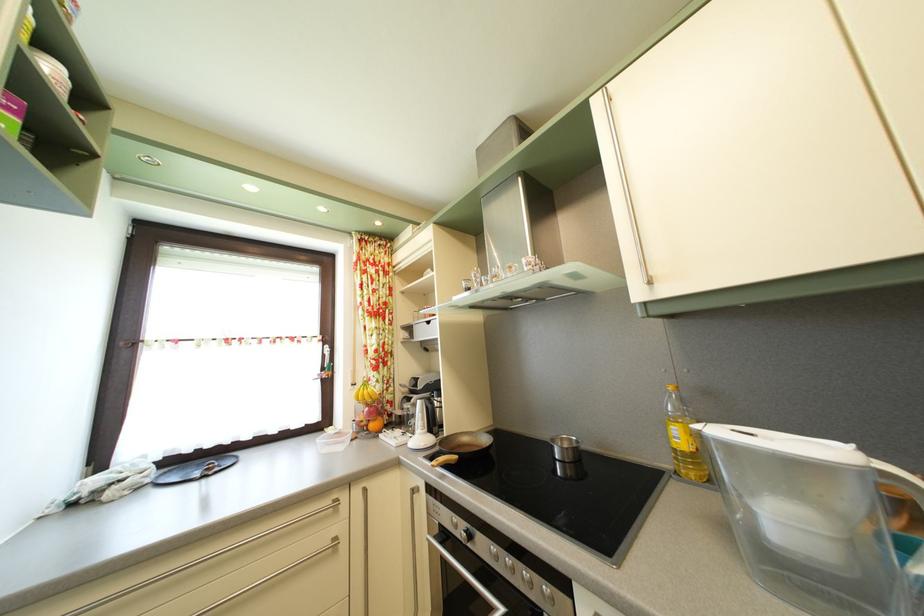
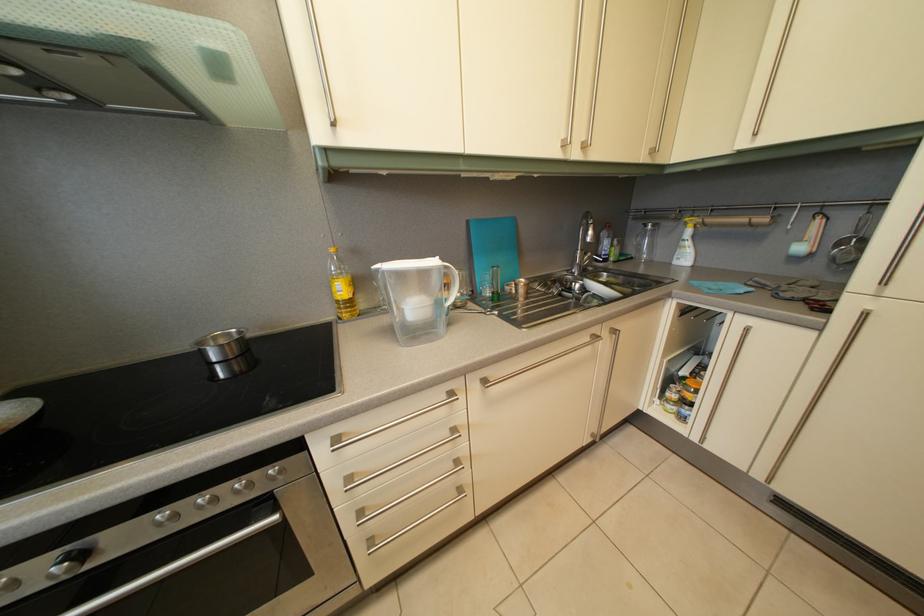
In the second image, find the point that corresponds to (x=569, y=448) in the first image.

(224, 346)